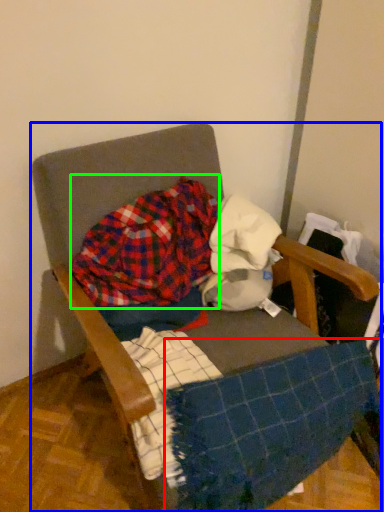
Question: Which object is the closest to the blanket (highlighted by a red box)? Choose among these: chair (highlighted by a blue box) or flannel (highlighted by a green box).

Choices:
 (A) chair
 (B) flannel

Answer: (A)